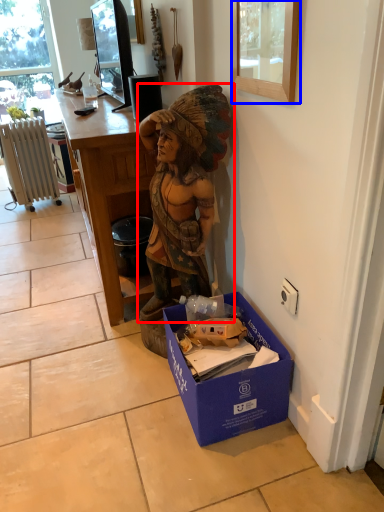
Question: Which point is closer to the camera, person (highlighted by a red box) or picture frame (highlighted by a blue box)?

Choices:
 (A) person
 (B) picture frame

Answer: (B)